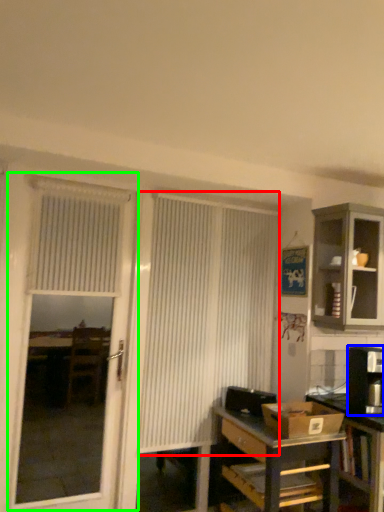
Question: Considering the real-world distances, which object is farthest from curtain (highlighted by a red box)? appliance (highlighted by a blue box) or screen door (highlighted by a green box)?

Choices:
 (A) appliance
 (B) screen door

Answer: (B)